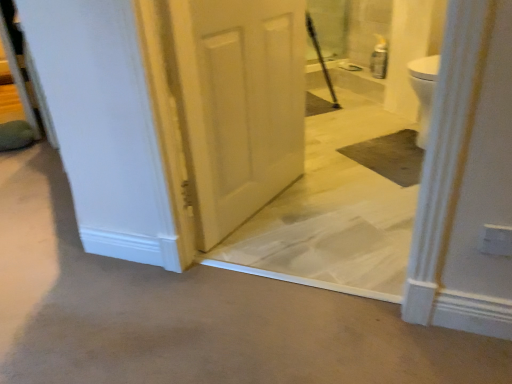
Question: From their relative heights in the image, would you say white glossy concrete at center is taller or shorter than white matte door at center?

Choices:
 (A) short
 (B) tall

Answer: (A)

Question: In terms of width, does white glossy concrete at center look wider or thinner when compared to white matte door at center?

Choices:
 (A) thin
 (B) wide

Answer: (B)

Question: Would you say white glossy concrete at center is to the left or to the right of white matte door at center in the picture?

Choices:
 (A) right
 (B) left

Answer: (B)

Question: Looking at their shapes, would you say white matte door at center is wider or thinner than white glossy concrete at center?

Choices:
 (A) thin
 (B) wide

Answer: (A)

Question: From a real-world perspective, is white matte door at center positioned above or below white glossy concrete at center?

Choices:
 (A) above
 (B) below

Answer: (A)

Question: Based on their sizes in the image, would you say white matte door at center is bigger or smaller than white glossy concrete at center?

Choices:
 (A) big
 (B) small

Answer: (B)

Question: Relative to white glossy concrete at center, is white matte door at center in front or behind?

Choices:
 (A) behind
 (B) front

Answer: (A)